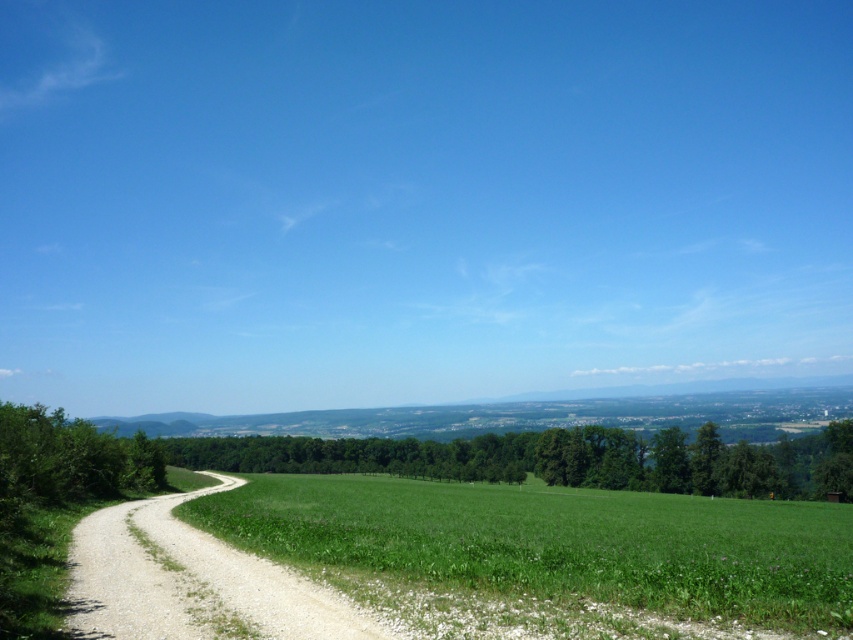
Question: Does green grass at center appear over green leafy trees at center?

Choices:
 (A) yes
 (B) no

Answer: (A)

Question: Which object is the closest to the green leafy tree at left?

Choices:
 (A) green grass at center
 (B) green leafy trees at center

Answer: (A)

Question: Is green grass at center thinner than green leafy tree at left?

Choices:
 (A) yes
 (B) no

Answer: (B)

Question: Which is nearer to the green leafy trees at center?

Choices:
 (A) green grass at center
 (B) green leafy tree at left

Answer: (A)

Question: Does green grass at center appear under green leafy trees at center?

Choices:
 (A) no
 (B) yes

Answer: (A)

Question: Which is nearer to the green leafy tree at left?

Choices:
 (A) green leafy trees at center
 (B) green grass at center

Answer: (B)